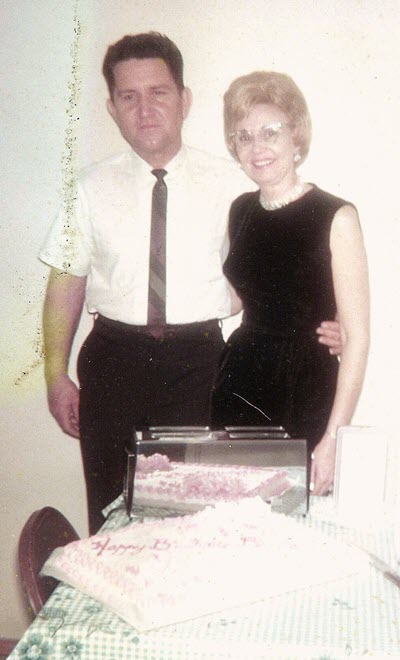
Where is `green and white checkered tablecloth`? The image size is (400, 660). green and white checkered tablecloth is located at coordinates (276, 635).